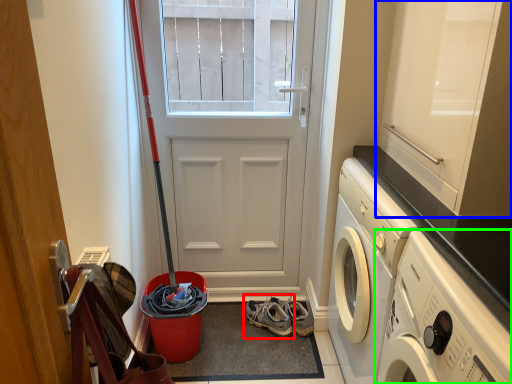
Question: Estimate the real-world distances between objects in this image. Which object is closer to footwear (highlighted by a red box), cabinetry (highlighted by a blue box) or washing machine (highlighted by a green box)?

Choices:
 (A) cabinetry
 (B) washing machine

Answer: (B)